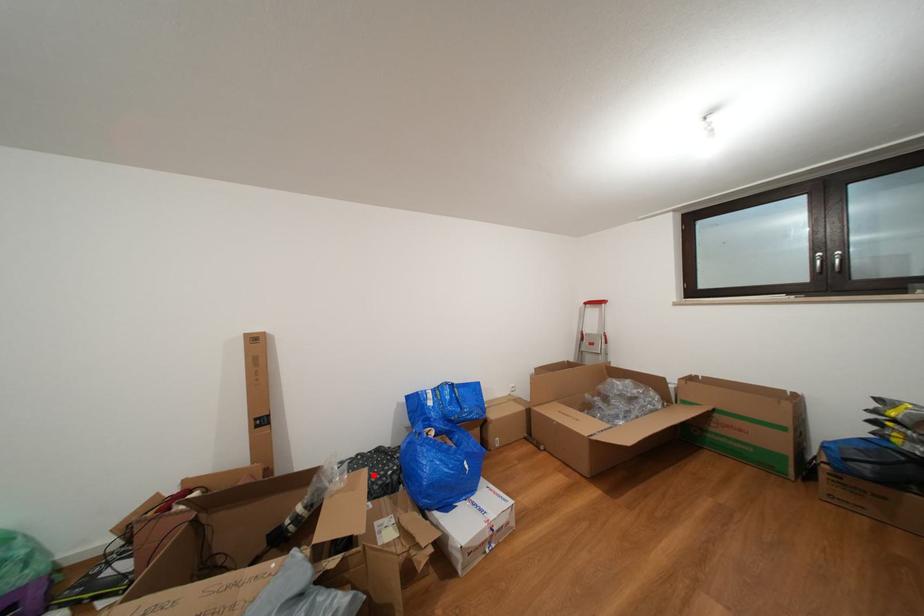
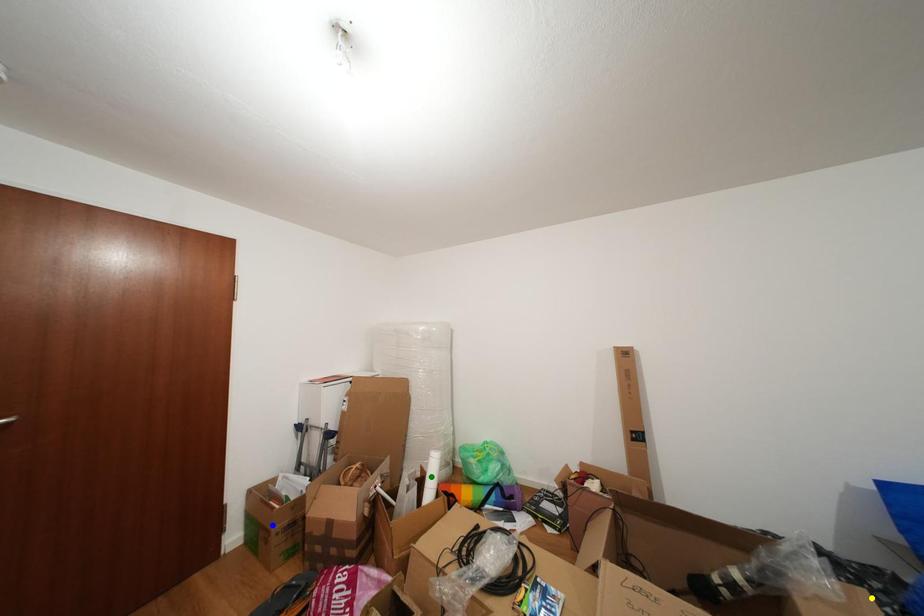
Question: I am providing you with two images of the same scene from different viewpoints. A red point is marked on the first image. You are given multiple points on the second image. Which point in image 2 is actually the same real-world point as the red point in image 1?

Choices:
 (A) yellow point
 (B) blue point
 (C) green point

Answer: (A)